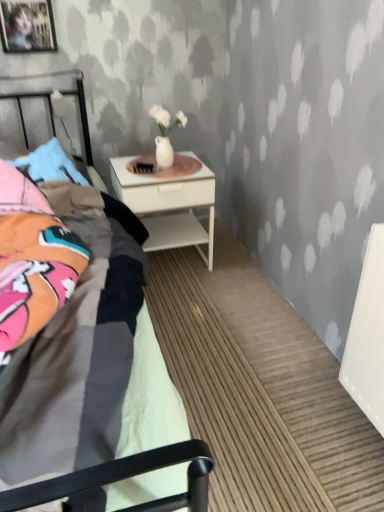
Question: From a real-world perspective, is white textured wall at upper center below white glossy nightstand at center?

Choices:
 (A) no
 (B) yes

Answer: (A)

Question: From a real-world perspective, is white textured wall at upper center over white glossy nightstand at center?

Choices:
 (A) yes
 (B) no

Answer: (A)

Question: Does white textured wall at upper center appear on the right side of white glossy nightstand at center?

Choices:
 (A) yes
 (B) no

Answer: (B)

Question: Can you confirm if white textured wall at upper center is taller than white glossy nightstand at center?

Choices:
 (A) no
 (B) yes

Answer: (B)

Question: Considering the relative sizes of white textured wall at upper center and white glossy nightstand at center in the image provided, is white textured wall at upper center shorter than white glossy nightstand at center?

Choices:
 (A) yes
 (B) no

Answer: (B)

Question: Is white textured wall at upper center thinner than white glossy nightstand at center?

Choices:
 (A) yes
 (B) no

Answer: (B)

Question: Considering the relative sizes of white textured wall at upper center and wooden picture frame at upper left in the image provided, is white textured wall at upper center bigger than wooden picture frame at upper left?

Choices:
 (A) yes
 (B) no

Answer: (A)

Question: Are white textured wall at upper center and wooden picture frame at upper left beside each other?

Choices:
 (A) yes
 (B) no

Answer: (B)

Question: Is white textured wall at upper center at the left side of wooden picture frame at upper left?

Choices:
 (A) yes
 (B) no

Answer: (B)

Question: Is white textured wall at upper center aimed at wooden picture frame at upper left?

Choices:
 (A) yes
 (B) no

Answer: (B)

Question: From the image's perspective, is white textured wall at upper center located beneath wooden picture frame at upper left?

Choices:
 (A) yes
 (B) no

Answer: (A)

Question: Can you confirm if white textured wall at upper center is wider than wooden picture frame at upper left?

Choices:
 (A) no
 (B) yes

Answer: (B)

Question: From a real-world perspective, is white glossy nightstand at center below wooden picture frame at upper left?

Choices:
 (A) yes
 (B) no

Answer: (A)